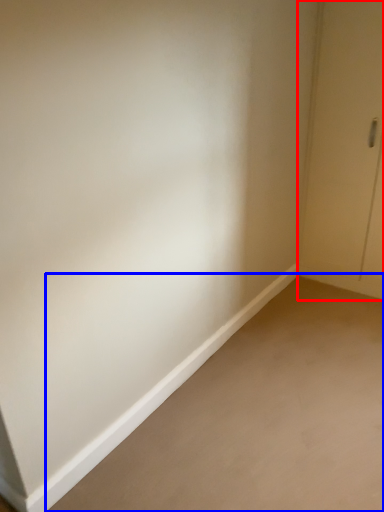
Question: Which point is closer to the camera, door (highlighted by a red box) or plain (highlighted by a blue box)?

Choices:
 (A) door
 (B) plain

Answer: (B)